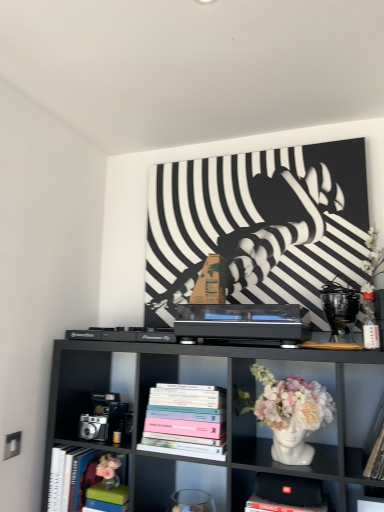
Question: From their relative heights in the image, would you say black matte shelf at center, the 2th shelf positioned from the bottom, is taller or shorter than hardcover book at left, placed as the 1th book when sorted from left to right?

Choices:
 (A) tall
 (B) short

Answer: (A)

Question: Is black matte shelf at center, the 2th shelf positioned from the bottom, in front of or behind hardcover book at left, placed as the 1th book when sorted from left to right, in the image?

Choices:
 (A) behind
 (B) front

Answer: (B)

Question: Which is nearer to the black plastic toy at upper right, marked as the 1th toy in a right-to-left arrangement?

Choices:
 (A) black matte shelf at center, placed as the 1th shelf when sorted from top to bottom
 (B) hardcover books at center, which is counted as the second book, starting from the bottom
 (C) metallic silver camera at lower left, the 1th toy from the left
 (D) hardcover book at left, positioned as the first book in bottom-to-top order
 (E) black fabric speaker at lower center, which is counted as the first shelf, starting from the bottom

Answer: (A)

Question: Which object is the closest to the black matte shelf at center, the 2th shelf positioned from the bottom?

Choices:
 (A) hardcover books at center, acting as the second book starting from the left
 (B) metallic silver camera at lower left, the first toy when ordered from bottom to top
 (C) black plastic toy at upper right, the 1th toy when ordered from top to bottom
 (D) black fabric speaker at lower center, which ranks as the 2th shelf in top-to-bottom order
 (E) white glossy vase at center

Answer: (A)